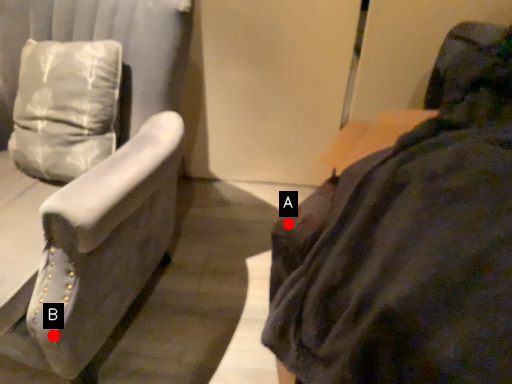
Question: Two points are circled on the image, labeled by A and B beside each circle. Among these points, which one is farthest from the camera?

Choices:
 (A) A is further
 (B) B is further

Answer: (B)